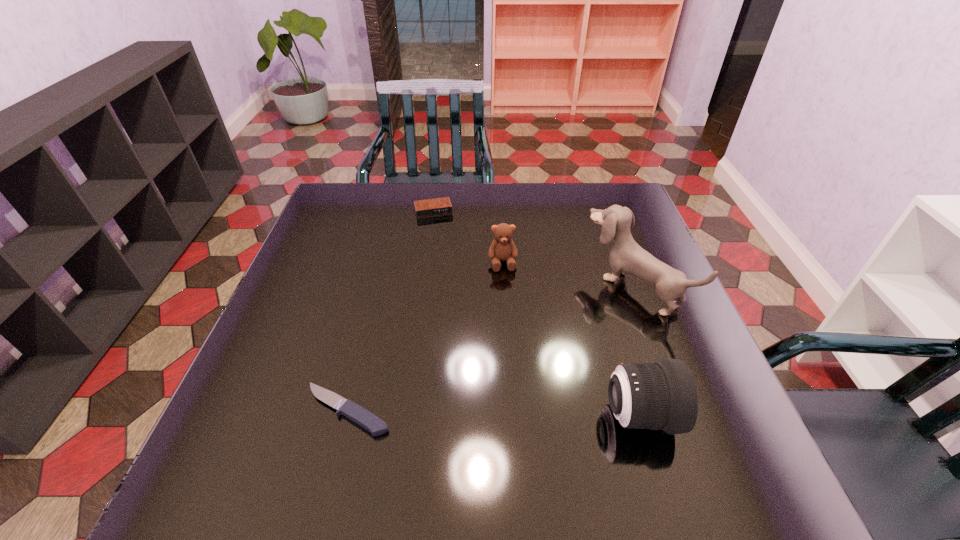
This screenshot has height=540, width=960. I want to click on vacant area at the near left corner, so click(276, 429).

Where is `vacant region at the far right corner of the desktop`? vacant region at the far right corner of the desktop is located at coordinates (626, 185).

Where is `blank region between the farthest object and the third object from right to left`? blank region between the farthest object and the third object from right to left is located at coordinates (468, 237).

Find the location of `free area in between the steak knife and the third object from right to left`. free area in between the steak knife and the third object from right to left is located at coordinates (425, 336).

The image size is (960, 540). What are the coordinates of `unoccupied position between the shortest object and the alarm clock` in the screenshot? It's located at (391, 310).

Where is `free space between the teddy bear and the steak knife`? free space between the teddy bear and the steak knife is located at coordinates [425, 336].

Identify the location of free point between the farthest object and the puppy. The width and height of the screenshot is (960, 540). (533, 249).

At what (x,y) coordinates should I click in order to perform the action: click on empty space that is in between the third shortest object and the puppy. Please return your answer as a coordinate pair (x, y). The width and height of the screenshot is (960, 540). Looking at the image, I should click on point(567,275).

Where is `free area in between the telephoto lens and the third object from right to left`? The image size is (960, 540). free area in between the telephoto lens and the third object from right to left is located at coordinates (570, 339).

The height and width of the screenshot is (540, 960). Find the location of `free spot between the shortest object and the fourth shortest object`. free spot between the shortest object and the fourth shortest object is located at coordinates (493, 413).